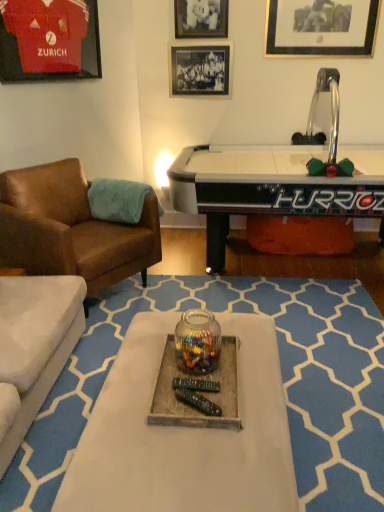
Find the location of a particular element. Image resolution: width=384 pixels, height=512 pixels. free space that is to the left of black plastic remote control at center, arranged as the second remote control when viewed from the back is located at coordinates (164, 407).